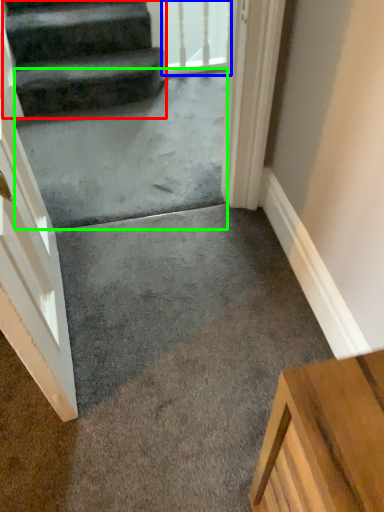
Question: Estimate the real-world distances between objects in this image. Which object is closer to stairs (highlighted by a red box), glass door (highlighted by a blue box) or concrete (highlighted by a green box)?

Choices:
 (A) glass door
 (B) concrete

Answer: (B)